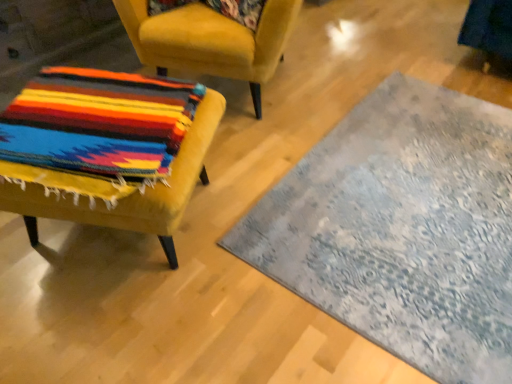
Question: Does velvet yellow chair at left, the 2th chair when ordered from top to bottom, come behind multicolored woven fabric at left, the 1th chair in the top-to-bottom sequence?

Choices:
 (A) no
 (B) yes

Answer: (A)

Question: From the image's perspective, is velvet yellow chair at left, the 1th chair from the bottom, under multicolored woven fabric at left, the 2th chair positioned from the bottom?

Choices:
 (A) yes
 (B) no

Answer: (A)

Question: Does velvet yellow chair at left, the 1th chair from the bottom, come in front of multicolored woven fabric at left, the 1th chair in the top-to-bottom sequence?

Choices:
 (A) yes
 (B) no

Answer: (A)

Question: Considering the relative sizes of velvet yellow chair at left, the 2th chair when ordered from top to bottom, and multicolored woven fabric at left, the 2th chair positioned from the bottom, in the image provided, is velvet yellow chair at left, the 2th chair when ordered from top to bottom, thinner than multicolored woven fabric at left, the 2th chair positioned from the bottom,?

Choices:
 (A) yes
 (B) no

Answer: (A)

Question: Is velvet yellow chair at left, the 1th chair from the bottom, turned away from multicolored woven fabric at left, the 1th chair in the top-to-bottom sequence?

Choices:
 (A) yes
 (B) no

Answer: (B)

Question: Considering the positions of point (18, 185) and point (468, 119), is point (18, 185) closer or farther from the camera than point (468, 119)?

Choices:
 (A) closer
 (B) farther

Answer: (A)

Question: Is velvet yellow chair at left, the 1th chair from the bottom, to the left or to the right of textured gray rug at center in the image?

Choices:
 (A) right
 (B) left

Answer: (B)

Question: Based on their sizes in the image, would you say velvet yellow chair at left, the 2th chair when ordered from top to bottom, is bigger or smaller than textured gray rug at center?

Choices:
 (A) small
 (B) big

Answer: (B)

Question: In the image, is velvet yellow chair at left, the 1th chair from the bottom, positioned in front of or behind textured gray rug at center?

Choices:
 (A) behind
 (B) front

Answer: (B)

Question: In the image, is velvet yellow chair at left, the 1th chair from the bottom, positioned in front of or behind floral fabric pillow at upper center?

Choices:
 (A) behind
 (B) front

Answer: (B)

Question: In terms of size, does velvet yellow chair at left, the 1th chair from the bottom, appear bigger or smaller than floral fabric pillow at upper center?

Choices:
 (A) small
 (B) big

Answer: (B)

Question: Considering the positions of point (141, 127) and point (262, 4), is point (141, 127) closer or farther from the camera than point (262, 4)?

Choices:
 (A) closer
 (B) farther

Answer: (A)

Question: From a real-world perspective, relative to floral fabric pillow at upper center, is velvet yellow chair at left, the 1th chair from the bottom, vertically above or below?

Choices:
 (A) above
 (B) below

Answer: (B)

Question: Visually, is multicolored woven fabric at left, the 2th chair positioned from the bottom, positioned to the left or to the right of velvet yellow chair at left, the 2th chair when ordered from top to bottom?

Choices:
 (A) left
 (B) right

Answer: (B)

Question: Considering the positions of multicolored woven fabric at left, the 2th chair positioned from the bottom, and velvet yellow chair at left, the 2th chair when ordered from top to bottom, in the image, is multicolored woven fabric at left, the 2th chair positioned from the bottom, wider or thinner than velvet yellow chair at left, the 2th chair when ordered from top to bottom,?

Choices:
 (A) thin
 (B) wide

Answer: (B)